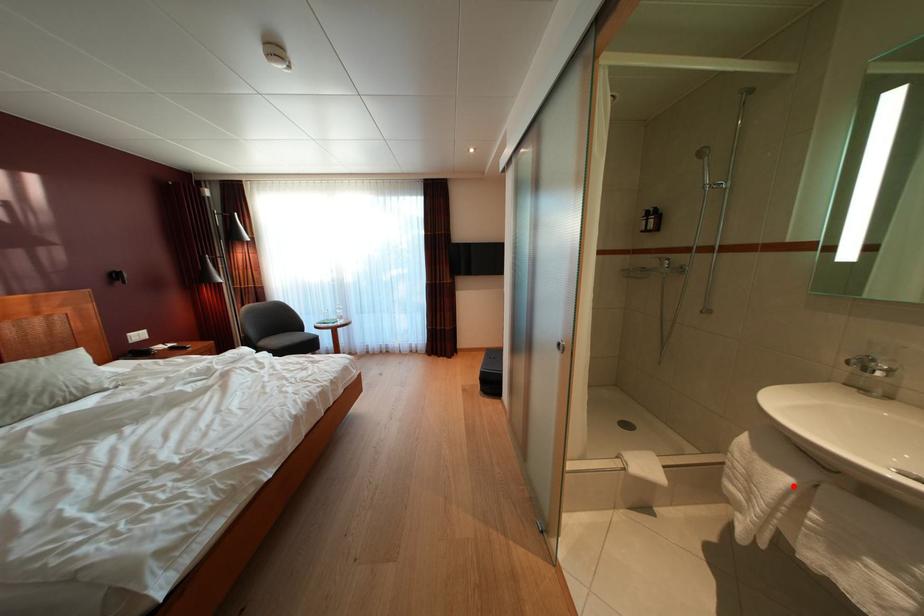
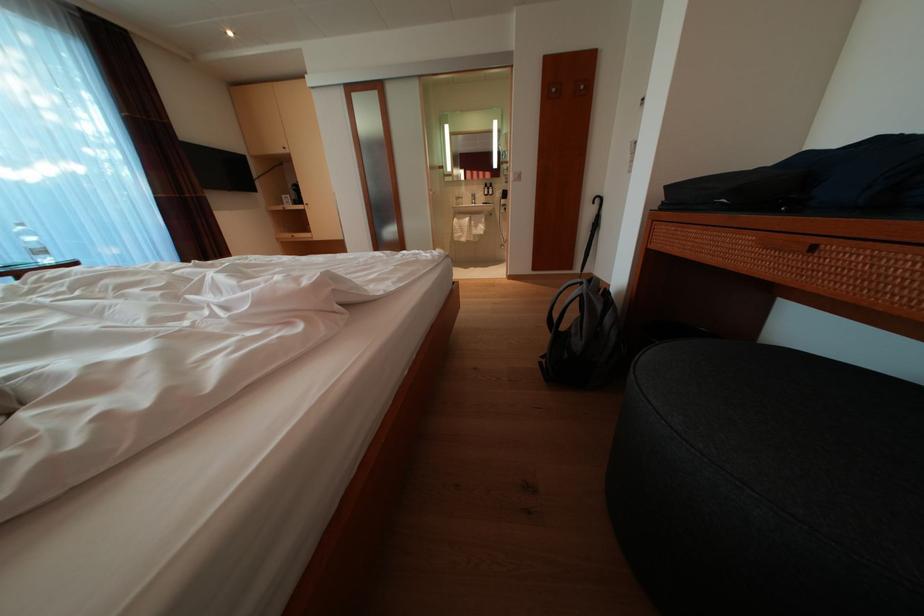
Question: I am providing you with two images of the same scene from different viewpoints. A red point is marked on the first image. Can you still see the location of the red point in image 2?

Choices:
 (A) Yes
 (B) No

Answer: (A)